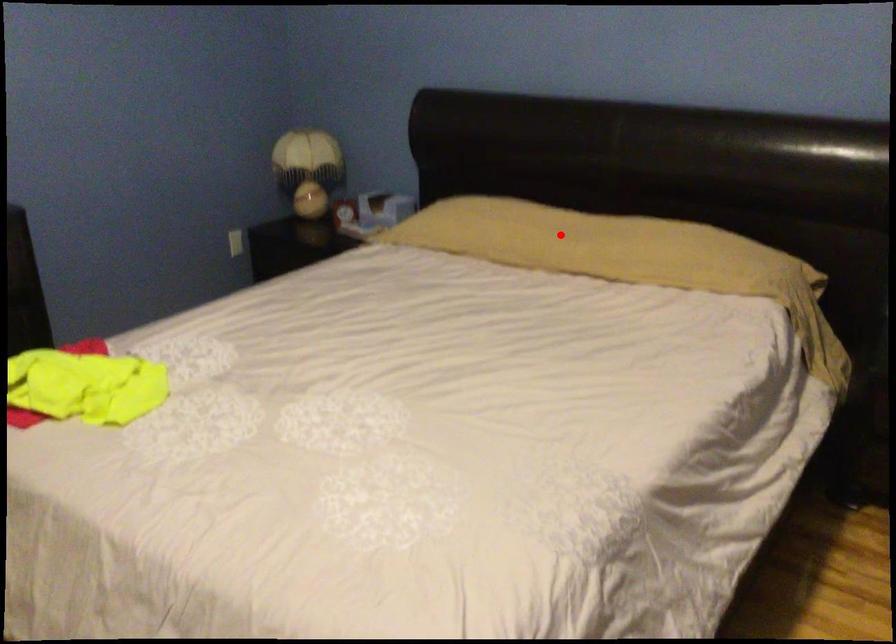
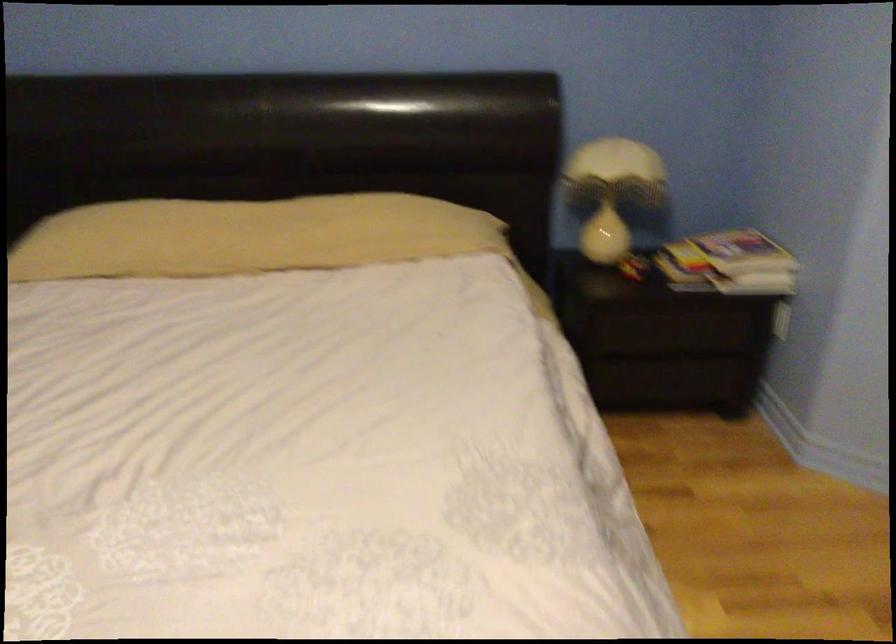
Question: I am providing you with two images of the same scene from different viewpoints. A red point is marked on the first image. Can you still see the location of the red point in image 2?

Choices:
 (A) Yes
 (B) No

Answer: (A)